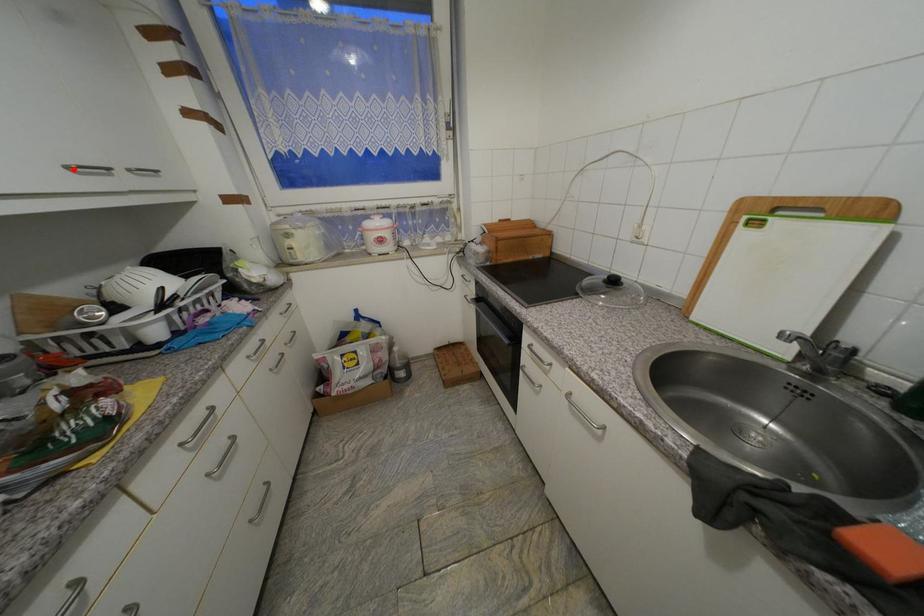
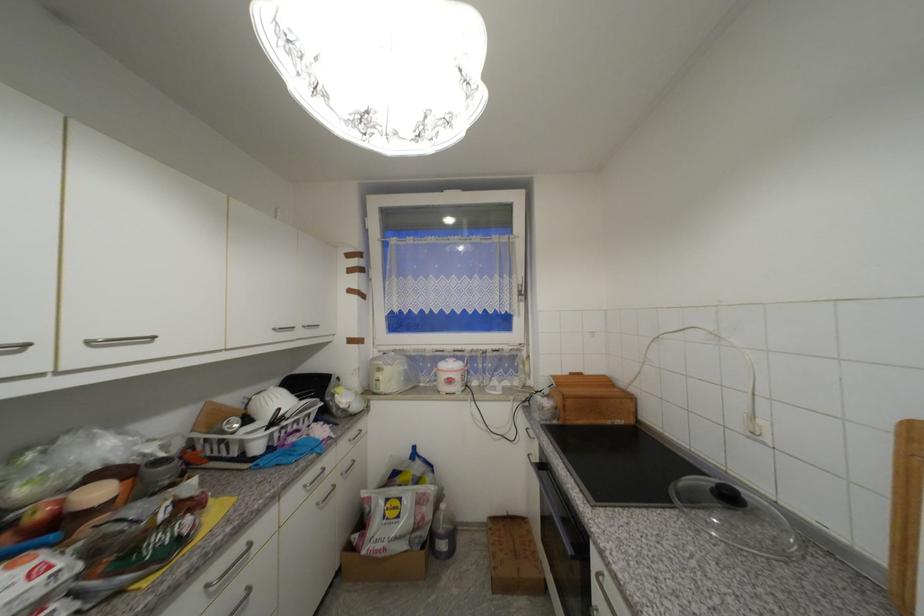
Where in the second image is the point corresponding to the highlighted location from the first image?

(281, 331)